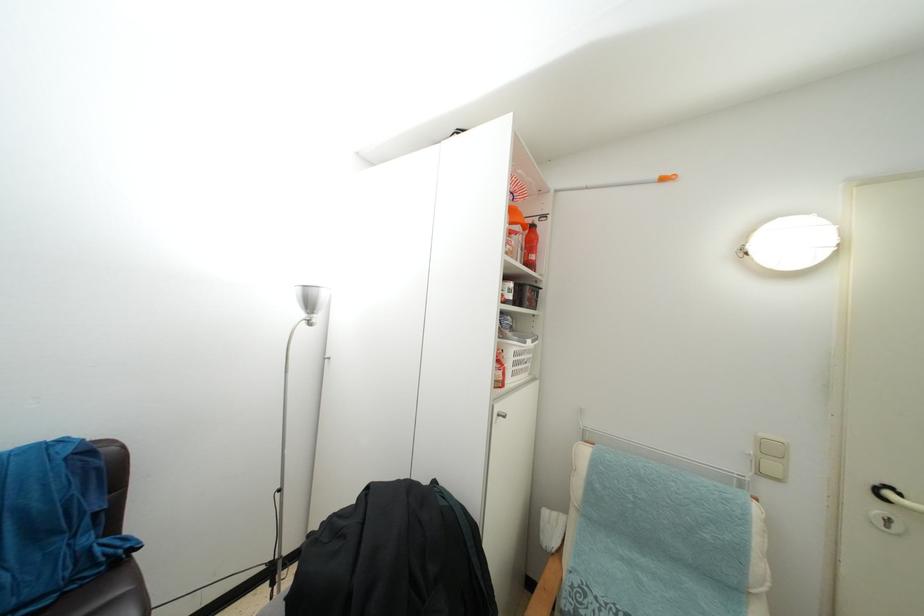
I want to click on light switch button, so click(771, 468).